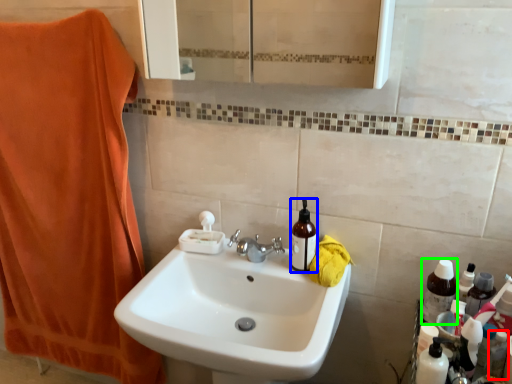
Question: Which is nearer to the toiletry (highlighted by a red box)? bottle (highlighted by a blue box) or bottle (highlighted by a green box).

Choices:
 (A) bottle
 (B) bottle

Answer: (B)